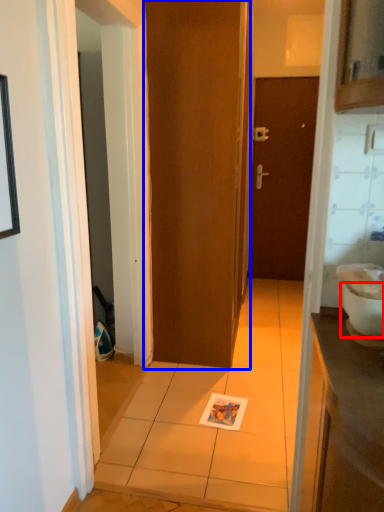
Question: Which point is further to the camera, toilet bowl (highlighted by a red box) or door (highlighted by a blue box)?

Choices:
 (A) toilet bowl
 (B) door

Answer: (B)